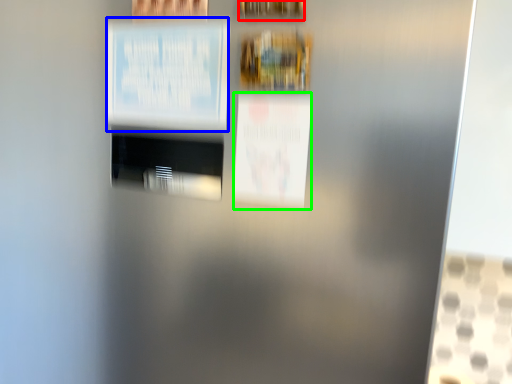
Question: Based on their relative distances, which object is farther from picture frame (highlighted by a red box)? Choose from poster (highlighted by a blue box) and poster (highlighted by a green box).

Choices:
 (A) poster
 (B) poster

Answer: (B)